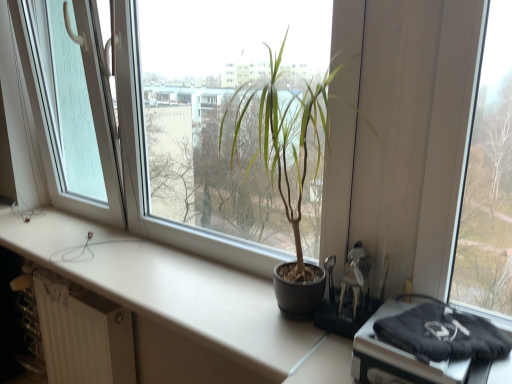
Image resolution: width=512 pixels, height=384 pixels. I want to click on empty space that is in between matte black pot at center and transparent glass door at left, so click(147, 269).